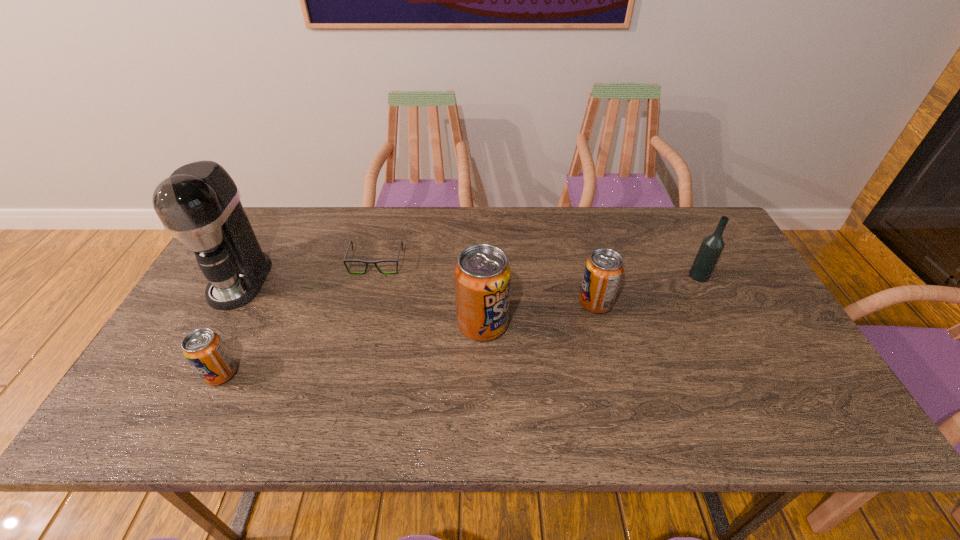
Where is `free space that satisfies the following two spatial constraints: 1. place cup under the spout of the tallest object; 2. on the right side of the rightmost soda can`? free space that satisfies the following two spatial constraints: 1. place cup under the spout of the tallest object; 2. on the right side of the rightmost soda can is located at coordinates (228, 302).

Image resolution: width=960 pixels, height=540 pixels. I want to click on free space in the image that satisfies the following two spatial constraints: 1. on the lens of the third object from left to right; 2. on the left side of the rightmost object, so click(373, 275).

Identify the location of vacant region that satisfies the following two spatial constraints: 1. place cup under the spout of the tallest object; 2. on the left side of the leftmost soda can. (189, 374).

What are the coordinates of `free space that satisfies the following two spatial constraints: 1. place cup under the spout of the tallest object; 2. on the right side of the fourth object from left to right` in the screenshot? It's located at (216, 324).